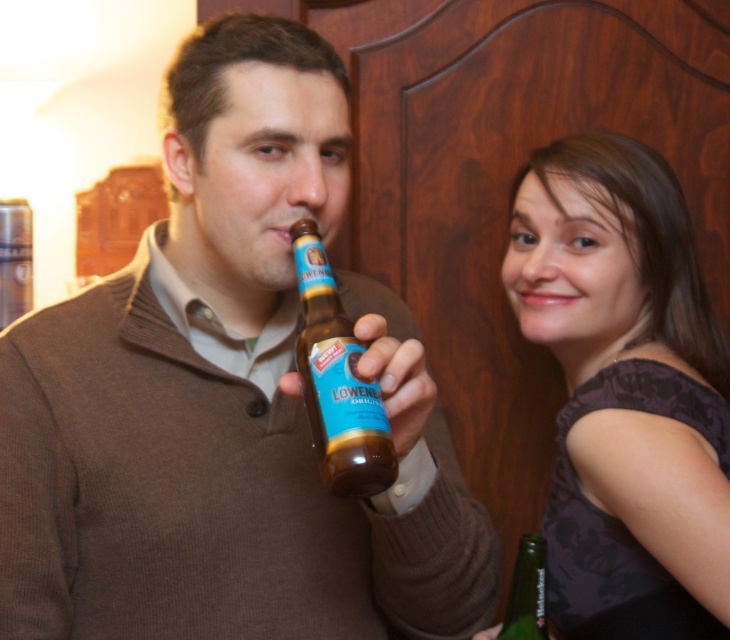
You are a bartender who needs to pour a drink into the brown glass bottle at center and the green glass bottle at lower right. Which bottle requires a larger pouring opening?

The brown glass bottle at center requires a larger pouring opening because it is bigger than the green glass bottle at lower right.

You are standing in the room and want to place a 12 inch tall object on the floor. Is the point at coordinates point (x=637, y=625) far enough from the camera to accommodate the object without it being in the camera view?

The distance of point (x=637, y=625) from camera is 32.91 inches, which is greater than the 12 inch height of the object. Therefore, placing the object there would keep it out of the camera view.

You are organizing a small party and need to arrange bottles on a shelf. You have a brown glass bottle at center and a green glass bottle at lower right. Based on their positions in the image, which bottle should you place higher on the shelf to replicate the arrangement?

The brown glass bottle at center should be placed higher on the shelf since it is positioned over the green glass bottle at lower right in the image.